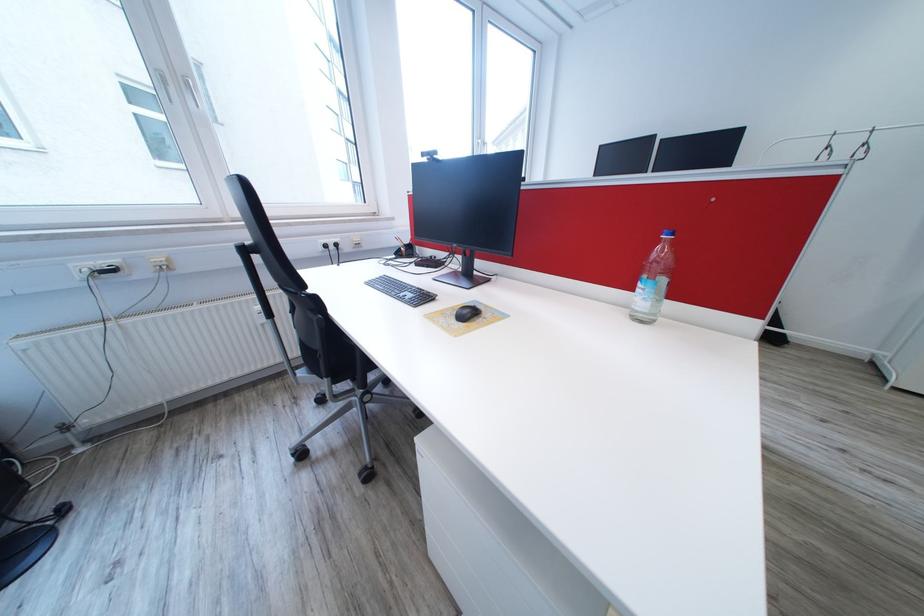
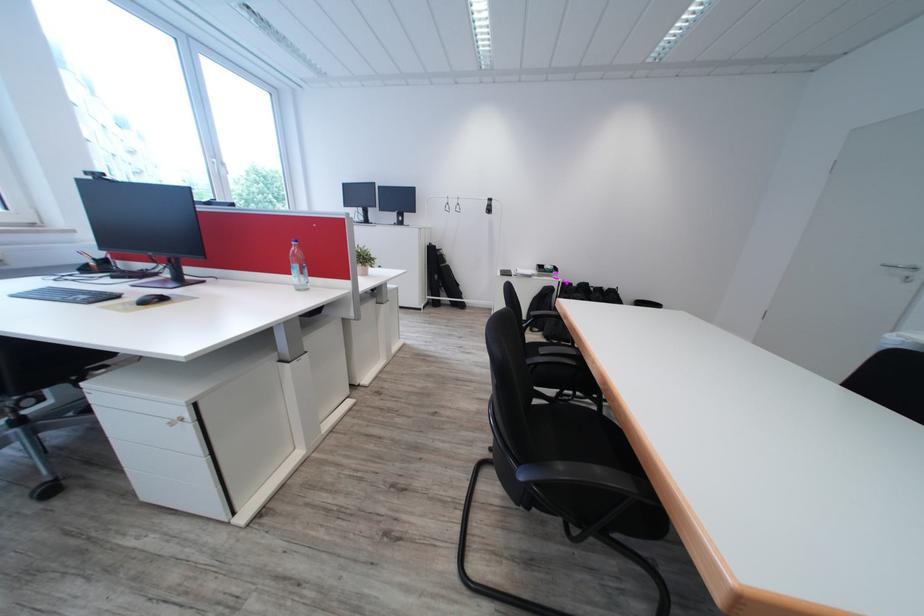
Where in the second image is the point corresponding to [378,285] from the first image?

(26, 298)